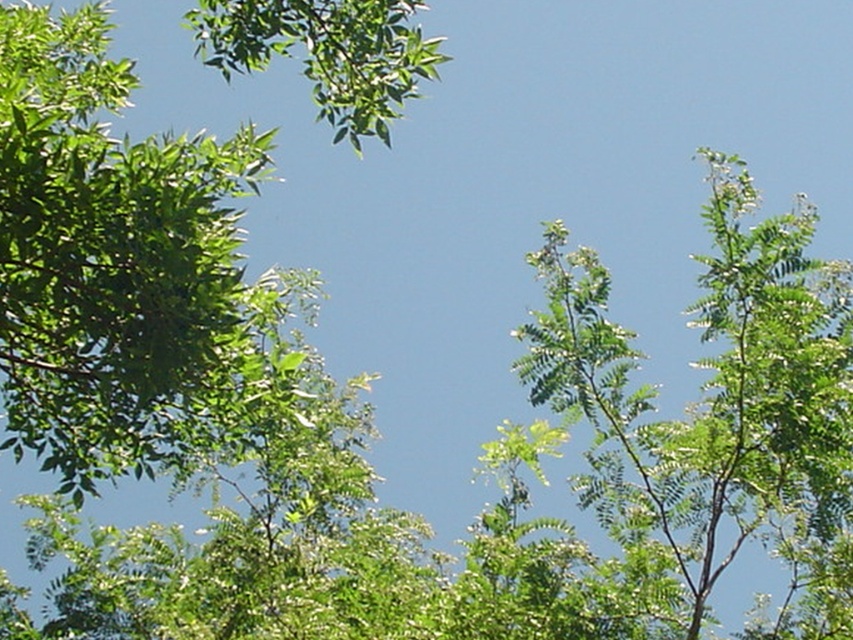
You are standing in a garden and want to take a photo of the green leafy tree at upper left. If you are facing the tree, which direction should you turn to ensure the tree is centered in your camera view?

Since the green leafy tree at upper left is positioned at point (x=119, y=269), you should turn slightly to your left to center it in your camera view.

You are standing in the middle of a garden and see the green leafy tree at upper left and the green leafy tree at upper right. Which tree is closer to you?

The green leafy tree at upper left is closer to you because it is in front of the green leafy tree at upper right.